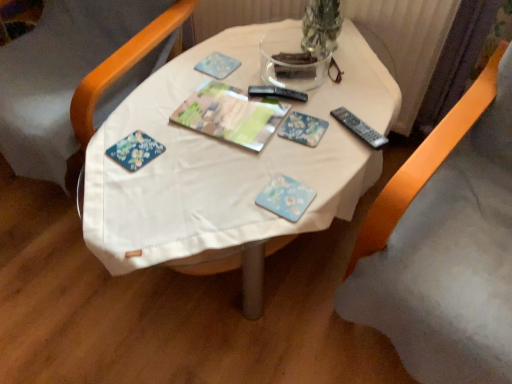
Question: In terms of width, does wooden chair at left, which is the second chair from right to left, look wider or thinner when compared to black plastic remote at right?

Choices:
 (A) thin
 (B) wide

Answer: (B)

Question: Is wooden chair at left, which is the second chair from right to left, taller or shorter than black plastic remote at right?

Choices:
 (A) tall
 (B) short

Answer: (A)

Question: Estimate the real-world distances between objects in this image. Which object is closer to the blue floral coaster at center, which is the second paperback book from top to bottom?

Choices:
 (A) floral-patterned paper at center, placed as the 2th paperback book when sorted from bottom to top
 (B) floral paper magazine at center
 (C) white fabric table at center
 (D) wooden chair at left, the 1th chair in the left-to-right sequence
 (E) black plastic remote at right

Answer: (A)

Question: Estimate the real-world distances between objects in this image. Which object is farther from the floral-patterned paper at center-left?

Choices:
 (A) wooden chair at left, the 1th chair in the left-to-right sequence
 (B) orange fabric chair at lower right, the second chair when ordered from left to right
 (C) blue floral coaster at center, the 2th paperback book viewed from the back
 (D) floral paper magazine at center
 (E) white fabric table at center

Answer: (B)